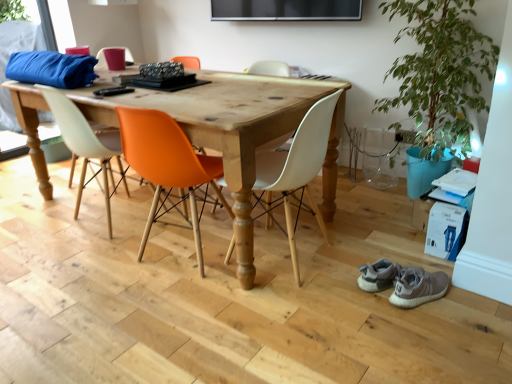
Question: Can you confirm if green leafy plant at right is taller than white matte chair at center, acting as the 4th chair starting from the left?

Choices:
 (A) no
 (B) yes

Answer: (B)

Question: Does green leafy plant at right have a lesser height compared to white matte chair at center, acting as the 4th chair starting from the left?

Choices:
 (A) yes
 (B) no

Answer: (B)

Question: Does green leafy plant at right appear on the left side of white matte chair at center, arranged as the 1th chair when viewed from the right?

Choices:
 (A) no
 (B) yes

Answer: (A)

Question: Is white matte chair at center, acting as the 4th chair starting from the left, surrounded by green leafy plant at right?

Choices:
 (A) no
 (B) yes

Answer: (A)

Question: From the image's perspective, is green leafy plant at right beneath white matte chair at center, arranged as the 1th chair when viewed from the right?

Choices:
 (A) yes
 (B) no

Answer: (B)

Question: Considering the positions of matte orange chair at center, arranged as the second chair when viewed from the left, and green leafy plant at right in the image, is matte orange chair at center, arranged as the second chair when viewed from the left, wider or thinner than green leafy plant at right?

Choices:
 (A) thin
 (B) wide

Answer: (B)

Question: Do you think matte orange chair at center, which is the third chair from right to left, is within green leafy plant at right, or outside of it?

Choices:
 (A) inside
 (B) outside

Answer: (B)

Question: Is point (99, 152) positioned closer to the camera than point (488, 69)?

Choices:
 (A) farther
 (B) closer

Answer: (B)

Question: From a real-world perspective, is matte orange chair at center, arranged as the second chair when viewed from the left, above or below green leafy plant at right?

Choices:
 (A) above
 (B) below

Answer: (B)

Question: Considering the positions of white matte chair at center, arranged as the 1th chair when viewed from the right, and orange plastic chair at center, which ranks as the 2th chair in right-to-left order, in the image, is white matte chair at center, arranged as the 1th chair when viewed from the right, bigger or smaller than orange plastic chair at center, which ranks as the 2th chair in right-to-left order,?

Choices:
 (A) big
 (B) small

Answer: (B)

Question: Is white matte chair at center, arranged as the 1th chair when viewed from the right, wider or thinner than orange plastic chair at center, which ranks as the 2th chair in right-to-left order?

Choices:
 (A) wide
 (B) thin

Answer: (B)

Question: Based on their positions, is white matte chair at center, arranged as the 1th chair when viewed from the right, located to the left or right of orange plastic chair at center, acting as the third chair starting from the left?

Choices:
 (A) right
 (B) left

Answer: (A)

Question: Considering their positions, is white matte chair at center, arranged as the 1th chair when viewed from the right, located in front of or behind orange plastic chair at center, acting as the third chair starting from the left?

Choices:
 (A) behind
 (B) front

Answer: (B)

Question: Based on their positions, is gray suede sneakers at lower right located to the left or right of matte orange chair at center, arranged as the second chair when viewed from the left?

Choices:
 (A) left
 (B) right

Answer: (B)

Question: Considering the positions of gray suede sneakers at lower right and matte orange chair at center, which is the third chair from right to left, in the image, is gray suede sneakers at lower right taller or shorter than matte orange chair at center, which is the third chair from right to left,?

Choices:
 (A) tall
 (B) short

Answer: (B)